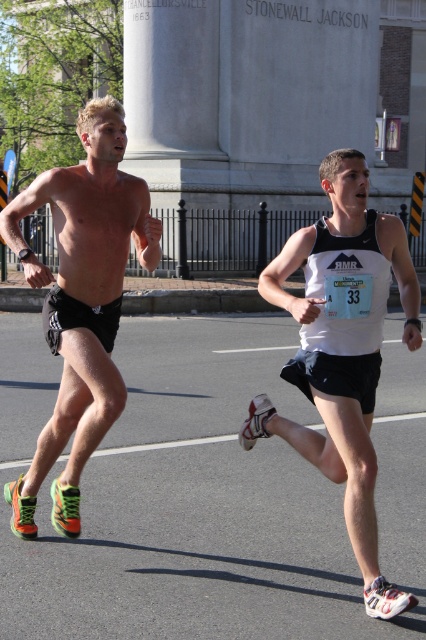
Is point (408, 330) less distant than point (92, 291)?

Yes, point (408, 330) is closer to viewer.

Does white matte tank top at center have a lesser height compared to neon green synthetic running shoes at left?

Yes, white matte tank top at center is shorter than neon green synthetic running shoes at left.

Which is behind, point (331, 424) or point (22, 497)?

The point (22, 497) is behind.

At what (x,y) coordinates should I click in order to perform the action: click on white matte tank top at center. Please return your answer as a coordinate pair (x, y). This screenshot has width=426, height=640. Looking at the image, I should click on (342, 349).